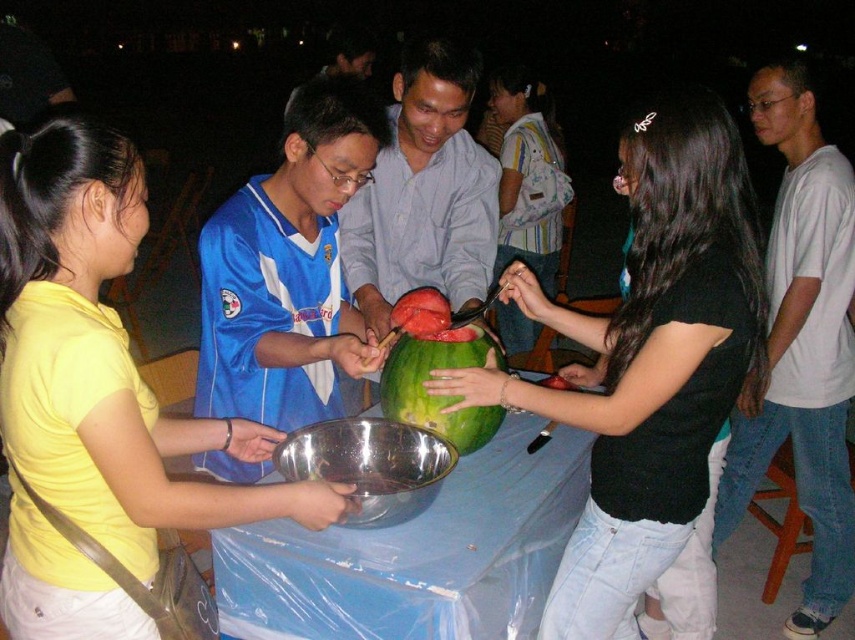
You are at a party and need to grab a drink from the green matte watermelon at center. You have a yellow matte shirt at left in your hand. Can you reach the watermelon without moving your feet?

The yellow matte shirt at left is 50.72 centimeters away from the green matte watermelon at center. Since the distance is more than an average person can reach without moving, you cannot reach the watermelon without moving your feet.